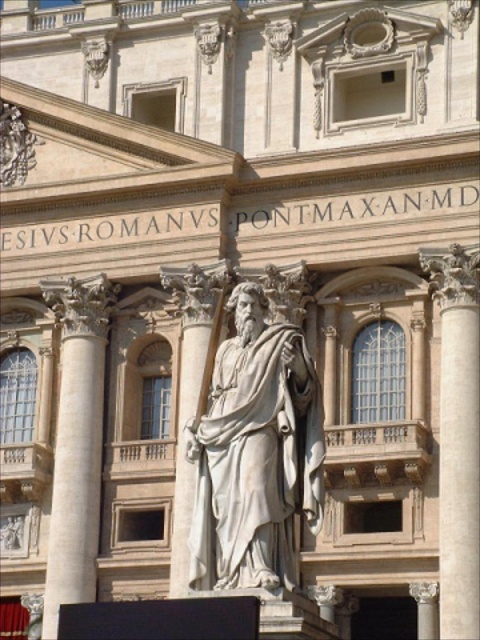
Image resolution: width=480 pixels, height=640 pixels. What do you see at coordinates (255, 452) in the screenshot?
I see `white marble statue at center` at bounding box center [255, 452].

Does white marble statue at center come in front of white marble column at center?

Yes, it is in front of white marble column at center.

The image size is (480, 640). What do you see at coordinates (255, 452) in the screenshot? I see `white marble statue at center` at bounding box center [255, 452].

Find the location of a particular element. Image resolution: width=480 pixels, height=640 pixels. white marble statue at center is located at coordinates (255, 452).

Between white marble statue at center and white marble column at left, which one has more height?

With more height is white marble column at left.

Does point (307, 369) come in front of point (68, 488)?

Yes, point (307, 369) is in front of point (68, 488).

You are a GUI agent. You are given a task and a screenshot of the screen. Output one action in this format:
    pyautogui.click(x=<x>, y=<y>)
    Task: Click on the white marble statue at center
    The image size is (480, 640).
    Given the screenshot: What is the action you would take?
    pyautogui.click(x=255, y=452)

Between white marble column at left and white marble column at center, which one appears on the right side from the viewer's perspective?

white marble column at center

Does white marble column at left have a larger size compared to white marble column at center?

Yes, white marble column at left is bigger than white marble column at center.

Is point (70, 502) positioned after point (474, 564)?

Yes, point (70, 502) is farther from viewer.

The image size is (480, 640). What are the coordinates of `white marble column at left` in the screenshot? It's located at (76, 442).